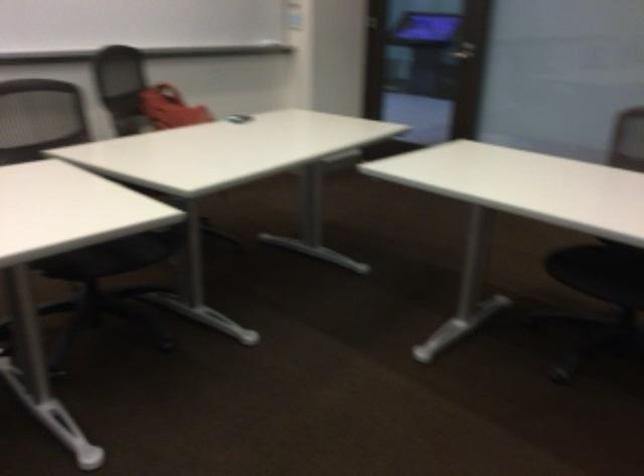
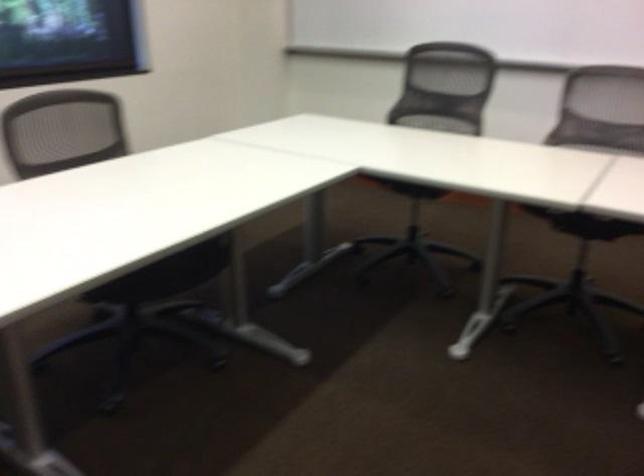
Question: The camera is either moving clockwise (left) or counter-clockwise (right) around the object. The first image is from the beginning of the video and the second image is from the end. Is the camera moving left or right when shooting the video?

Choices:
 (A) Left
 (B) Right

Answer: (B)